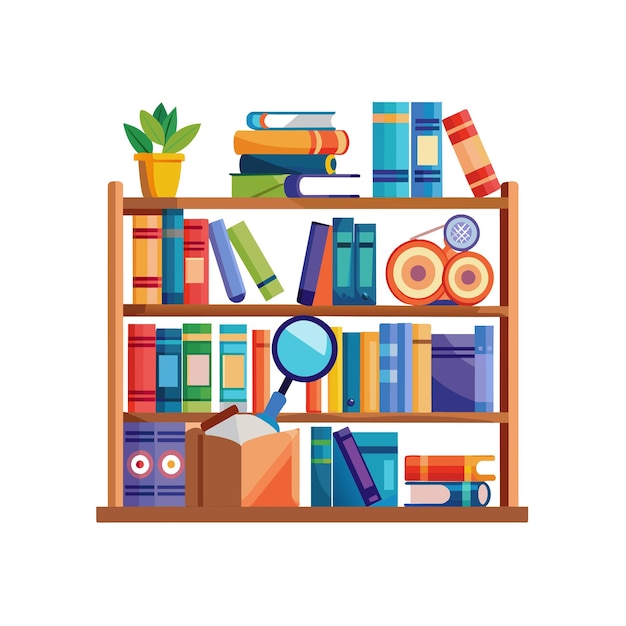
Where is `shelf`? shelf is located at coordinates (439, 202), (416, 316), (423, 416), (423, 513).